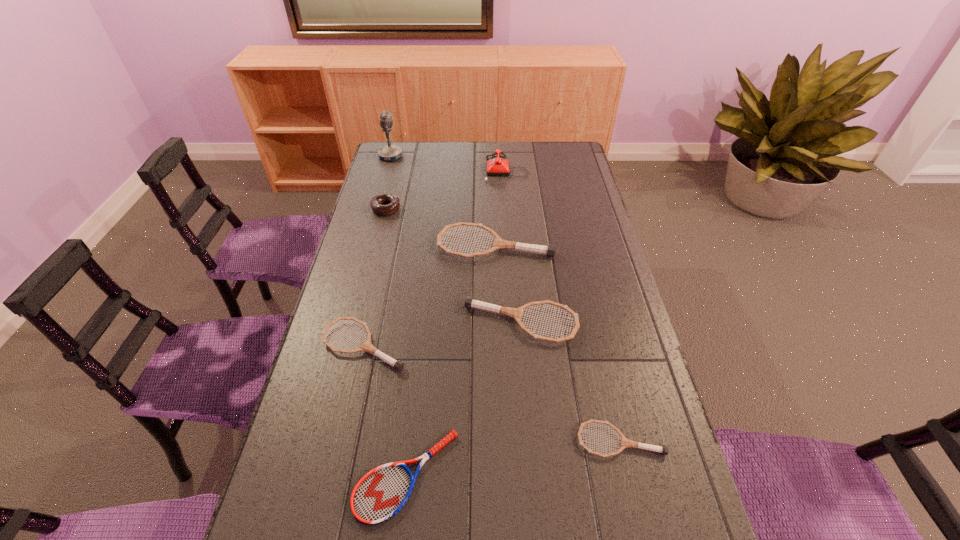
Identify the location of free space between the second biggest gray tennis racket and the third tallest tennis racket. Image resolution: width=960 pixels, height=540 pixels. (443, 335).

Where is `vacant space in between the leftmost gray tennis racket and the sixth nearest object`? The height and width of the screenshot is (540, 960). vacant space in between the leftmost gray tennis racket and the sixth nearest object is located at coordinates (374, 278).

Locate which object ranks fifth in proximity to the fourth tallest tennis racket. Please provide its 2D coordinates. Your answer should be formatted as a tuple, i.e. [(x, y)], where the tuple contains the x and y coordinates of a point satisfying the conditions above.

[(393, 203)]

Select which object is the third closest to the fourth tallest tennis racket. Please provide its 2D coordinates. Your answer should be formatted as a tuple, i.e. [(x, y)], where the tuple contains the x and y coordinates of a point satisfying the conditions above.

[(398, 365)]

This screenshot has width=960, height=540. I want to click on tennis racket that can be found as the closest to the fifth nearest object, so click(470, 303).

Identify which tennis racket is the second nearest to the doughnut. Please provide its 2D coordinates. Your answer should be formatted as a tuple, i.e. [(x, y)], where the tuple contains the x and y coordinates of a point satisfying the conditions above.

[(398, 365)]

Locate which gray tennis racket ranks fourth in proximity to the tallest object. Please provide its 2D coordinates. Your answer should be formatted as a tuple, i.e. [(x, y)], where the tuple contains the x and y coordinates of a point satisfying the conditions above.

[(625, 442)]

Identify which gray tennis racket is the fourth nearest to the telephone. Please provide its 2D coordinates. Your answer should be formatted as a tuple, i.e. [(x, y)], where the tuple contains the x and y coordinates of a point satisfying the conditions above.

[(625, 442)]

Image resolution: width=960 pixels, height=540 pixels. I want to click on vacant space that satisfies the following two spatial constraints: 1. on the back side of the nearest gray tennis racket; 2. on the dial of the red telephone, so click(x=558, y=170).

The image size is (960, 540). I want to click on blank area in the image that satisfies the following two spatial constraints: 1. on the front-facing side of the brown doughnut; 2. on the left side of the microphone, so click(376, 209).